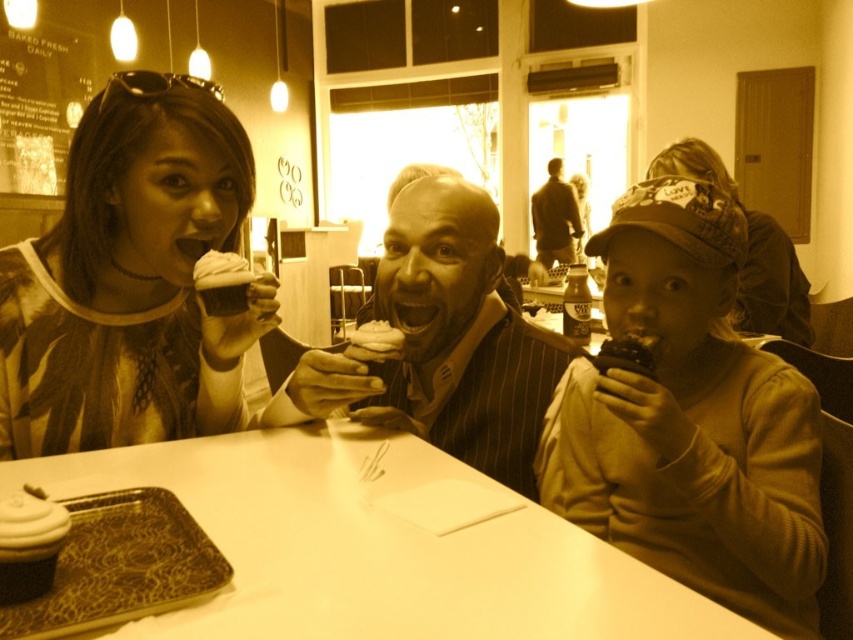
Question: Which point is closer to the camera taking this photo?

Choices:
 (A) (421, 282)
 (B) (403, 336)
 (C) (770, 582)

Answer: (C)

Question: Among these objects, which one is nearest to the camera?

Choices:
 (A) spongy chocolate cake at center
 (B) matte black suit at center

Answer: (A)

Question: Is matte black suit at center to the left of matte chocolate cupcake at lower left from the viewer's perspective?

Choices:
 (A) no
 (B) yes

Answer: (A)

Question: Is matte black cupcake at left in front of spongy chocolate cake at center?

Choices:
 (A) yes
 (B) no

Answer: (A)

Question: Does white glossy table at center appear on the right side of matte black cupcake at left?

Choices:
 (A) yes
 (B) no

Answer: (A)

Question: Which is nearer to the white glossy table at center?

Choices:
 (A) brown leather jacket at upper center
 (B) metallic silver can at center

Answer: (B)